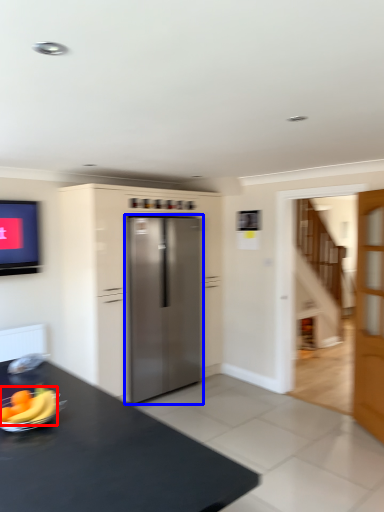
Question: Which point is closer to the camera, banana (highlighted by a red box) or refrigerator (highlighted by a blue box)?

Choices:
 (A) banana
 (B) refrigerator

Answer: (A)